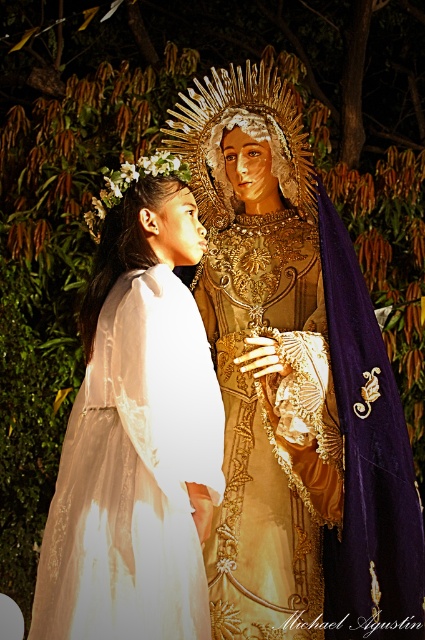
Which is more to the right, white lace dress at left or gold satin dress at center?

gold satin dress at center is more to the right.

Between point (217, 438) and point (305, 317), which one is positioned in front?

Point (217, 438) is more forward.

Is point (175, 541) farther from viewer compared to point (272, 321)?

No, it is not.

Locate an element on the screen. white lace dress at left is located at coordinates (136, 436).

Who is taller, white lace dress at left or gold textured crown at center?

white lace dress at left

Which is more to the right, white lace dress at left or gold textured crown at center?

gold textured crown at center is more to the right.

Is point (141, 317) positioned behind point (235, 134)?

No, (141, 317) is closer to viewer.

I want to click on white lace dress at left, so click(x=136, y=436).

What do you see at coordinates (271, 429) in the screenshot? The width and height of the screenshot is (425, 640). I see `gold satin dress at center` at bounding box center [271, 429].

Is gold satin dress at center closer to camera compared to gold textured crown at center?

Yes, it is in front of gold textured crown at center.

Looking at this image, who is more forward, (226, 346) or (275, 236)?

Point (226, 346) is in front.

At what (x,y) coordinates should I click in order to perform the action: click on gold satin dress at center. Please return your answer as a coordinate pair (x, y). Looking at the image, I should click on (271, 429).